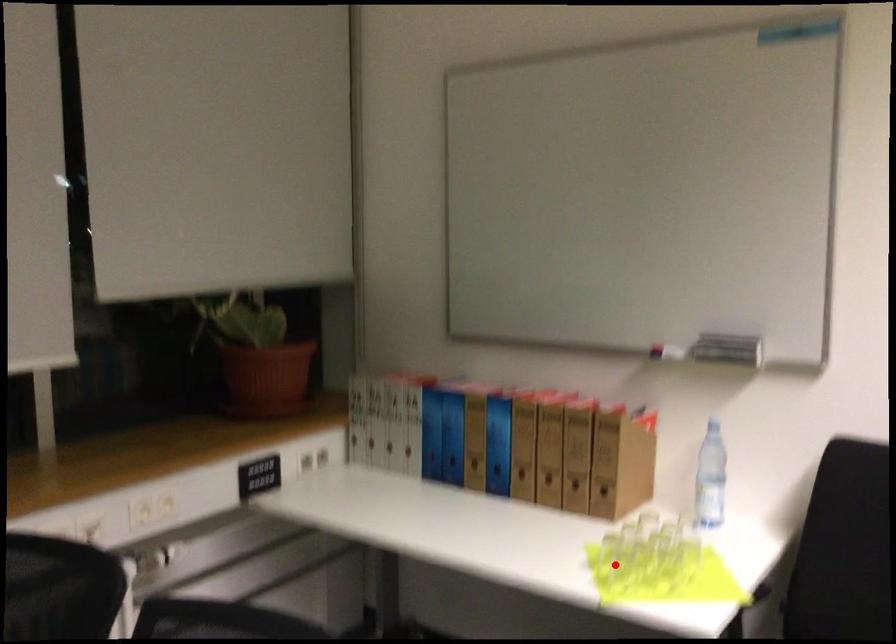
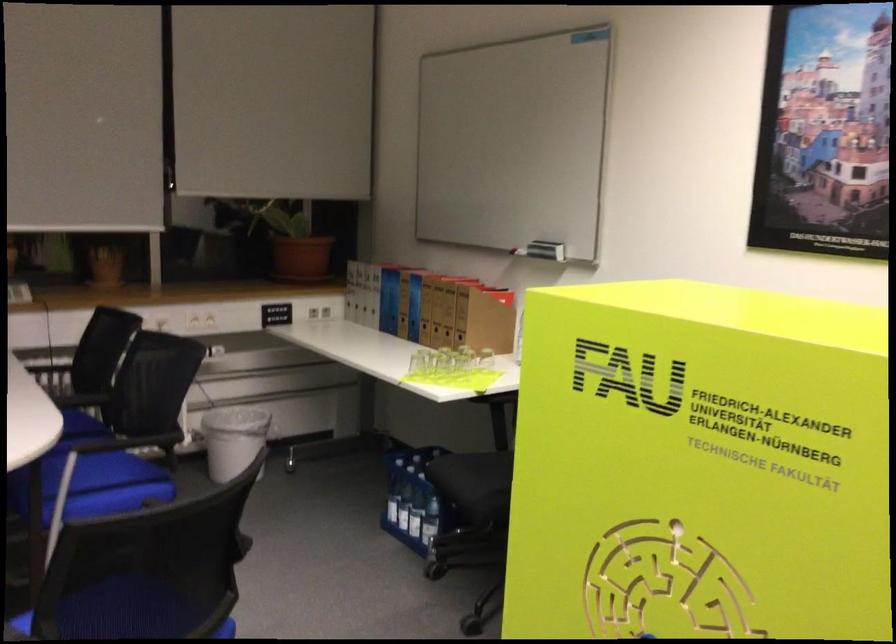
Question: I am providing you with two images of the same scene from different viewpoints. In image1, a red point is highlighted. Considering the same 3D point in image2, which of the following is correct?

Choices:
 (A) It is closer
 (B) It is farther

Answer: (B)